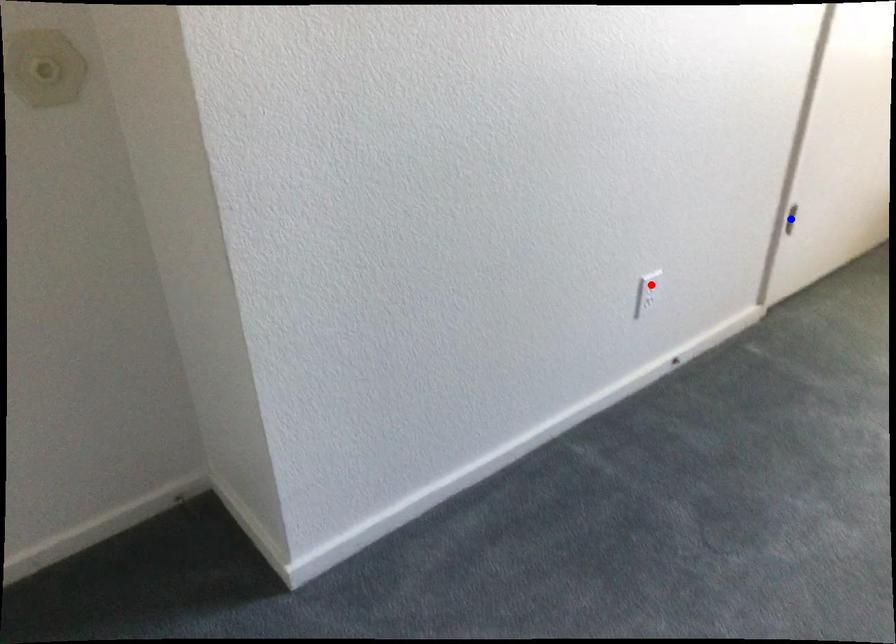
Question: In the image, two points are highlighted. Which point is nearer to the camera? Reply with the corresponding letter.

Choices:
 (A) blue point
 (B) red point

Answer: (B)